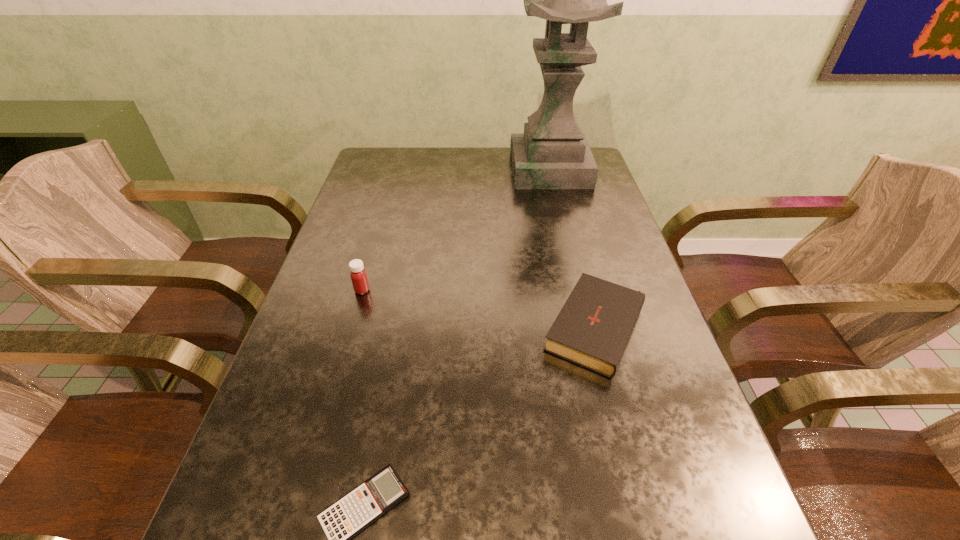
This screenshot has width=960, height=540. I want to click on object at the far edge, so click(552, 153).

Where is `object at the left edge`? object at the left edge is located at coordinates (358, 275).

Find the location of a particular element. Image resolution: width=960 pixels, height=540 pixels. sculpture situated at the right edge is located at coordinates (552, 153).

The image size is (960, 540). What are the coordinates of `Bible present at the right edge` in the screenshot? It's located at (593, 328).

Locate an element on the screen. object located at the far right corner is located at coordinates (552, 153).

In the image, there is a desktop. Identify the location of vacant space at the far edge. (494, 168).

This screenshot has width=960, height=540. In the image, there is a desktop. In order to click on free space at the left edge in this screenshot , I will do `click(356, 222)`.

Locate an element on the screen. The width and height of the screenshot is (960, 540). vacant region at the right edge of the desktop is located at coordinates (607, 221).

Identify the location of free space at the far left corner of the desktop. The image size is (960, 540). (372, 150).

The image size is (960, 540). I want to click on empty space that is in between the third shortest object and the second shortest object, so click(480, 309).